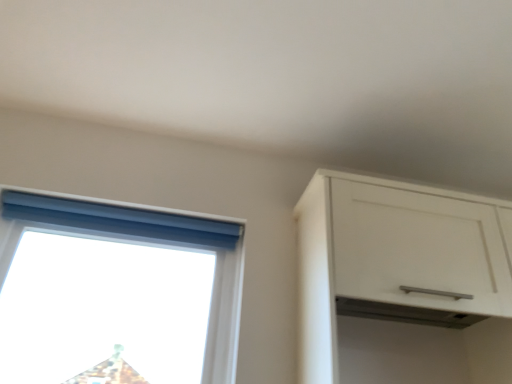
Question: Is white matte cabinet at upper right smaller than transparent plastic window at upper left?

Choices:
 (A) no
 (B) yes

Answer: (A)

Question: From the image's perspective, is white matte cabinet at upper right below transparent plastic window at upper left?

Choices:
 (A) no
 (B) yes

Answer: (A)

Question: Is white matte cabinet at upper right wider than transparent plastic window at upper left?

Choices:
 (A) yes
 (B) no

Answer: (A)

Question: Is white matte cabinet at upper right outside transparent plastic window at upper left?

Choices:
 (A) yes
 (B) no

Answer: (A)

Question: Can transparent plastic window at upper left be found inside white matte cabinet at upper right?

Choices:
 (A) no
 (B) yes

Answer: (A)

Question: Considering the relative sizes of white matte cabinet at upper right and transparent plastic window at upper left in the image provided, is white matte cabinet at upper right thinner than transparent plastic window at upper left?

Choices:
 (A) yes
 (B) no

Answer: (B)

Question: Considering the relative sizes of transparent plastic window at upper left and white matte cabinet at upper right in the image provided, is transparent plastic window at upper left shorter than white matte cabinet at upper right?

Choices:
 (A) no
 (B) yes

Answer: (B)

Question: From a real-world perspective, does transparent plastic window at upper left stand above white matte cabinet at upper right?

Choices:
 (A) yes
 (B) no

Answer: (B)

Question: Is there a large distance between transparent plastic window at upper left and white matte cabinet at upper right?

Choices:
 (A) no
 (B) yes

Answer: (A)

Question: Is transparent plastic window at upper left turned away from white matte cabinet at upper right?

Choices:
 (A) no
 (B) yes

Answer: (A)

Question: Would you say white matte cabinet at upper right is part of transparent plastic window at upper left's contents?

Choices:
 (A) yes
 (B) no

Answer: (B)

Question: Is transparent plastic window at upper left not inside white matte cabinet at upper right?

Choices:
 (A) yes
 (B) no

Answer: (A)

Question: Considering the relative positions of transparent plastic window at upper left and blue fabric curtain at upper left in the image provided, is transparent plastic window at upper left to the right of blue fabric curtain at upper left from the viewer's perspective?

Choices:
 (A) no
 (B) yes

Answer: (A)